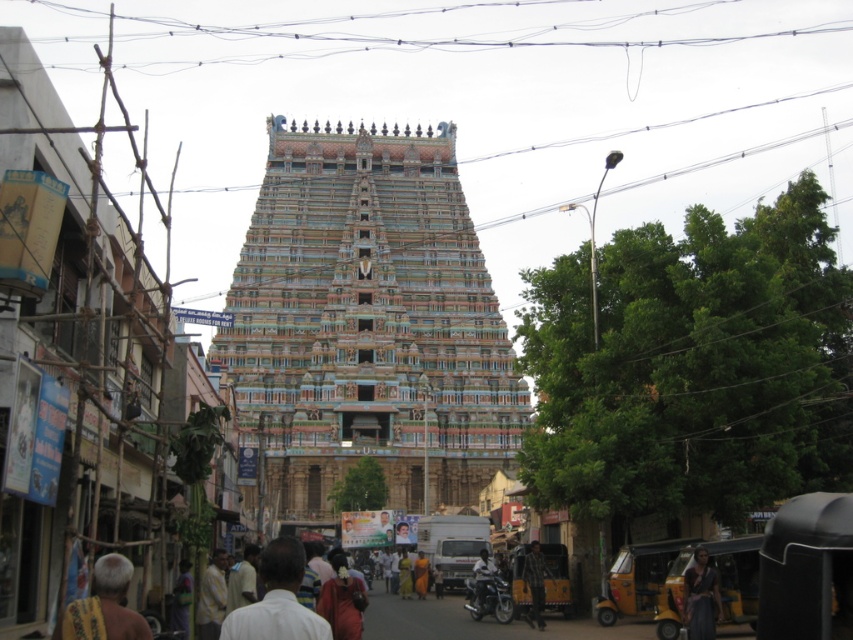
Between multicolored painted temple at center and dark gray fabric at lower right, which one appears on the right side from the viewer's perspective?

Positioned to the right is dark gray fabric at lower right.

Can you confirm if multicolored painted temple at center is bigger than dark gray fabric at lower right?

Yes, multicolored painted temple at center is bigger than dark gray fabric at lower right.

Which is behind, point (483, 291) or point (700, 593)?

Positioned behind is point (483, 291).

Identify the location of multicolored painted temple at center. (367, 323).

Is point (260, 566) more distant than point (534, 588)?

No.

Does white matte shirt at center appear under plaid fabric person at lower center?

No, white matte shirt at center is not below plaid fabric person at lower center.

Locate an element on the screen. The width and height of the screenshot is (853, 640). white matte shirt at center is located at coordinates (277, 600).

Locate an element on the screen. This screenshot has height=640, width=853. white matte shirt at center is located at coordinates (277, 600).

This screenshot has height=640, width=853. I want to click on white matte shirt at center, so 277,600.

The image size is (853, 640). I want to click on white matte shirt at center, so click(x=277, y=600).